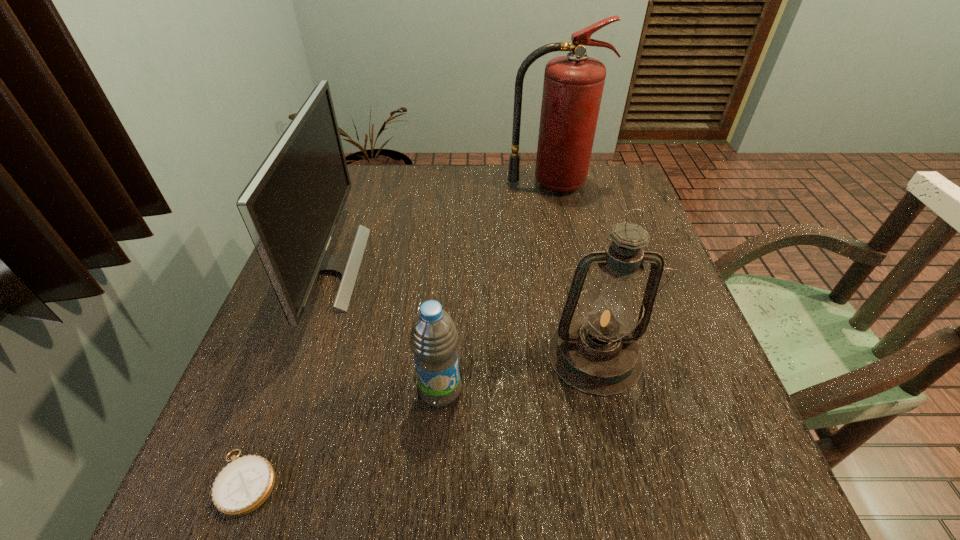
Identify the location of vacant space in between the oil lamp and the monitor. (461, 311).

Find the location of a particular element. This screenshot has height=540, width=960. free space between the third object from left to right and the shortest object is located at coordinates coord(343,436).

At what (x,y) coordinates should I click in order to perform the action: click on vacant space that's between the tallest object and the shortest object. Please return your answer as a coordinate pair (x, y). Looking at the image, I should click on click(x=398, y=333).

The image size is (960, 540). I want to click on vacant region between the shortest object and the oil lamp, so click(420, 418).

Locate an element on the screen. The image size is (960, 540). free space between the third object from right to left and the tallest object is located at coordinates (495, 287).

What are the coordinates of `vacant area that lies between the compass and the tallest object` in the screenshot? It's located at (398, 333).

Identify the location of free point between the oil lamp and the monitor. (461, 311).

You are a GUI agent. You are given a task and a screenshot of the screen. Output one action in this format:
    pyautogui.click(x=<x>, y=<y>)
    Task: Click on the free point between the nearest object and the second shortest object
    The image size is (960, 540).
    Given the screenshot: What is the action you would take?
    pyautogui.click(x=343, y=436)

I want to click on object that ranks as the fourth closest to the water bottle, so click(573, 85).

Select which object is the fourth closest to the oil lamp. Please provide its 2D coordinates. Your answer should be formatted as a tuple, i.e. [(x, y)], where the tuple contains the x and y coordinates of a point satisfying the conditions above.

[(242, 486)]